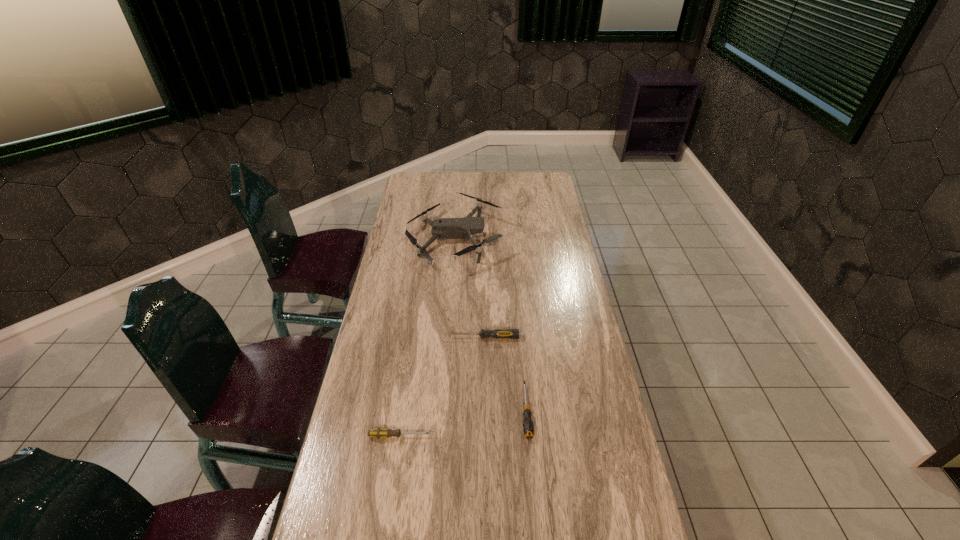
Identify the location of the closest object relative to the drone. (498, 333).

Locate which screwdriver is the second closest to the second farthest object. Please provide its 2D coordinates. Your answer should be formatted as a tuple, i.e. [(x, y)], where the tuple contains the x and y coordinates of a point satisfying the conditions above.

[(378, 433)]

The image size is (960, 540). In order to click on screwdriver that is the closest to the leftmost screwdriver in this screenshot , I will do `click(528, 427)`.